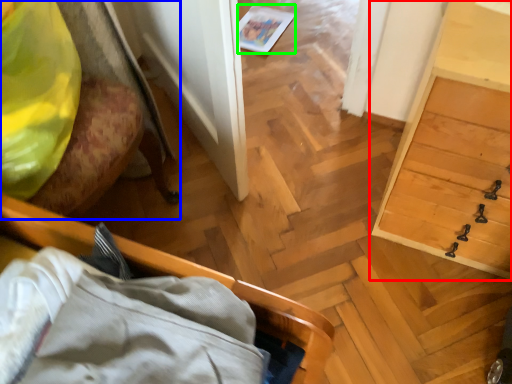
Question: Considering the real-world distances, which object is farthest from dresser (highlighted by a red box)? furniture (highlighted by a blue box) or magazine (highlighted by a green box)?

Choices:
 (A) furniture
 (B) magazine

Answer: (B)